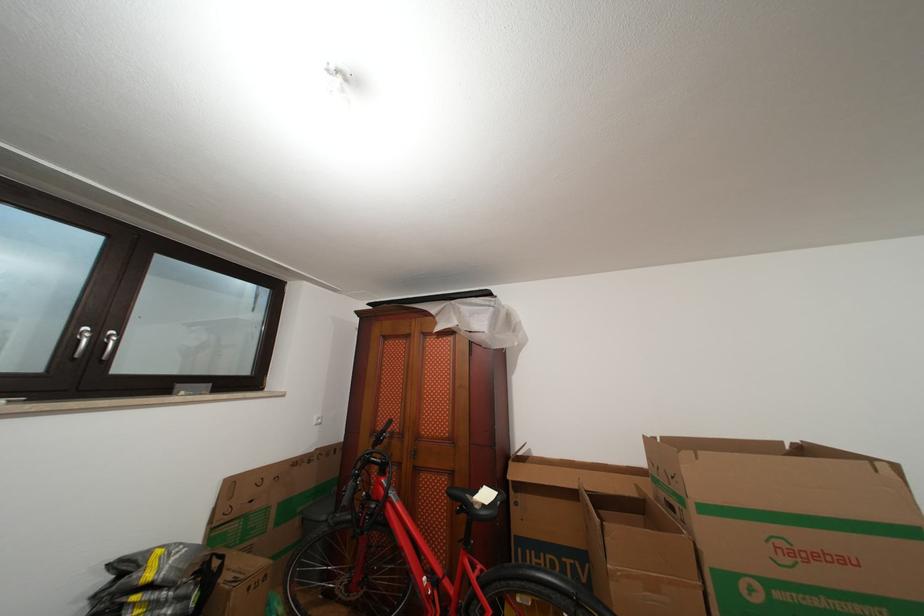
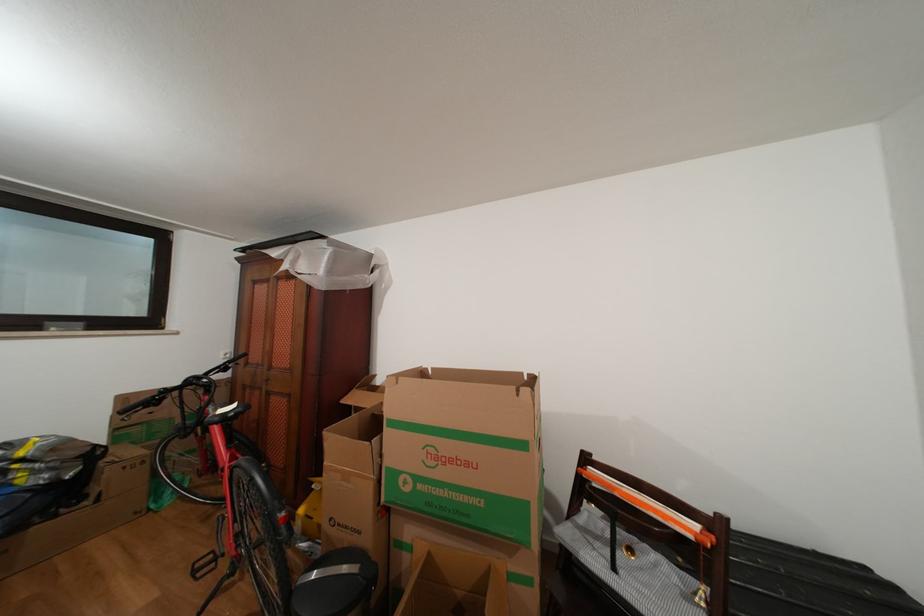
In the second image, find the point that corresponds to (x=517, y=483) in the first image.

(350, 407)